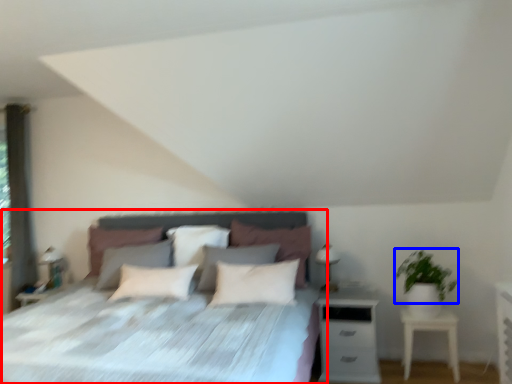
Question: Which of the following is the farthest to the observer, bed (highlighted by a red box) or plant (highlighted by a blue box)?

Choices:
 (A) bed
 (B) plant

Answer: (B)